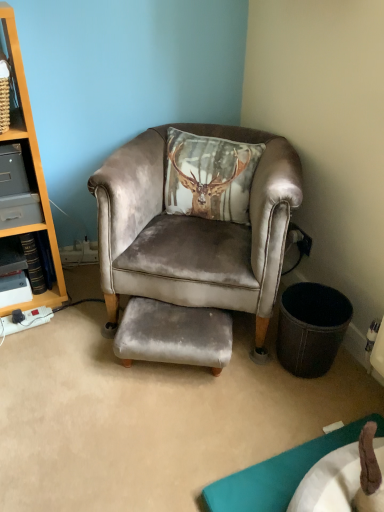
Question: From a real-world perspective, is velvet grey footrest at center physically below velvet grey chair at center?

Choices:
 (A) yes
 (B) no

Answer: (A)

Question: Is velvet grey footrest at center next to velvet grey chair at center?

Choices:
 (A) no
 (B) yes

Answer: (A)

Question: Is velvet grey footrest at center positioned beyond the bounds of velvet grey chair at center?

Choices:
 (A) yes
 (B) no

Answer: (B)

Question: Is velvet grey footrest at center bigger than velvet grey chair at center?

Choices:
 (A) no
 (B) yes

Answer: (A)

Question: Is velvet grey footrest at center shorter than velvet grey chair at center?

Choices:
 (A) yes
 (B) no

Answer: (A)

Question: Is point (208, 254) closer or farther from the camera than point (23, 164)?

Choices:
 (A) closer
 (B) farther

Answer: (A)

Question: In terms of width, does velvet grey chair at center look wider or thinner when compared to gray plastic drawer at left?

Choices:
 (A) thin
 (B) wide

Answer: (B)

Question: From the image's perspective, is velvet grey chair at center positioned above or below gray plastic drawer at left?

Choices:
 (A) above
 (B) below

Answer: (B)

Question: Looking at the image, does velvet grey chair at center seem bigger or smaller compared to gray plastic drawer at left?

Choices:
 (A) big
 (B) small

Answer: (A)

Question: Is velvet grey footrest at center wider or thinner than gray plastic drawer at left?

Choices:
 (A) wide
 (B) thin

Answer: (B)

Question: Do you think velvet grey footrest at center is within gray plastic drawer at left, or outside of it?

Choices:
 (A) inside
 (B) outside

Answer: (B)

Question: Looking at the image, does velvet grey footrest at center seem bigger or smaller compared to gray plastic drawer at left?

Choices:
 (A) big
 (B) small

Answer: (A)

Question: Is velvet grey footrest at center to the left or to the right of gray plastic drawer at left in the image?

Choices:
 (A) right
 (B) left

Answer: (A)

Question: Is gray plastic drawer at left situated inside velvet grey chair at center or outside?

Choices:
 (A) inside
 (B) outside

Answer: (B)

Question: In the image, is gray plastic drawer at left positioned in front of or behind velvet grey chair at center?

Choices:
 (A) behind
 (B) front

Answer: (A)